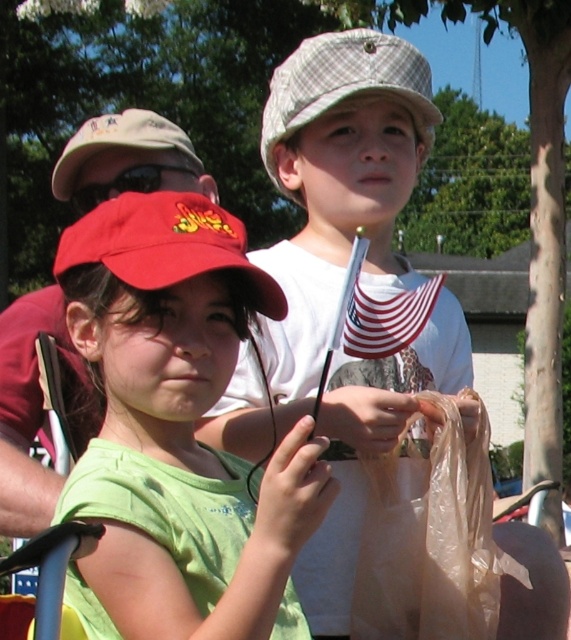
Locate an element on the screen. translucent plastic bag at lower right is located at coordinates (432, 541).

You are a GUI agent. You are given a task and a screenshot of the screen. Output one action in this format:
    pyautogui.click(x=<x>, y=<y>)
    Task: Click on the translucent plastic bag at lower right
    The height and width of the screenshot is (640, 571).
    Given the screenshot: What is the action you would take?
    pyautogui.click(x=432, y=541)

At what (x,y) coordinates should I click in order to perform the action: click on translucent plastic bag at lower right. Please return your answer as a coordinate pair (x, y). This screenshot has height=640, width=571. Looking at the image, I should click on (432, 541).

Between point (352, 497) and point (130, 212), which one is positioned in front?

Point (130, 212) is in front.

Is white cotton shirt at center shorter than matte red baseball cap at center?

Incorrect, white cotton shirt at center's height does not fall short of matte red baseball cap at center's.

Is point (367, 449) positioned in front of point (178, 204)?

No, (367, 449) is further to viewer.

Find the location of a particular element. The width and height of the screenshot is (571, 640). white cotton shirt at center is located at coordinates (339, 188).

Can you confirm if matte red baseball cap at center is bigger than matte khaki baseball cap at upper left?

No.

Does matte red baseball cap at center appear on the left side of matte khaki baseball cap at upper left?

Incorrect, matte red baseball cap at center is not on the left side of matte khaki baseball cap at upper left.

Between point (188, 220) and point (112, 115), which one is positioned behind?

Positioned behind is point (112, 115).

Find the location of a particular element. matte red baseball cap at center is located at coordinates (166, 244).